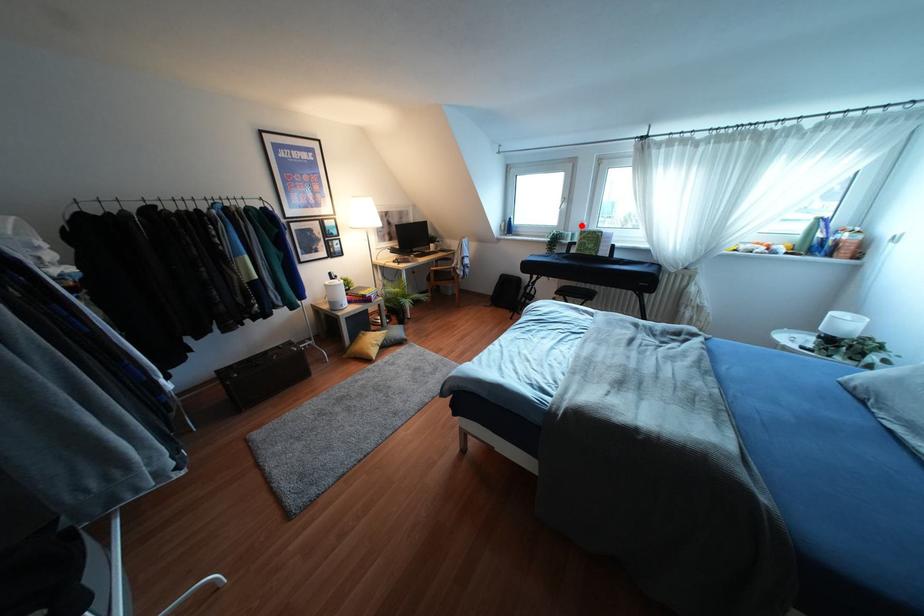
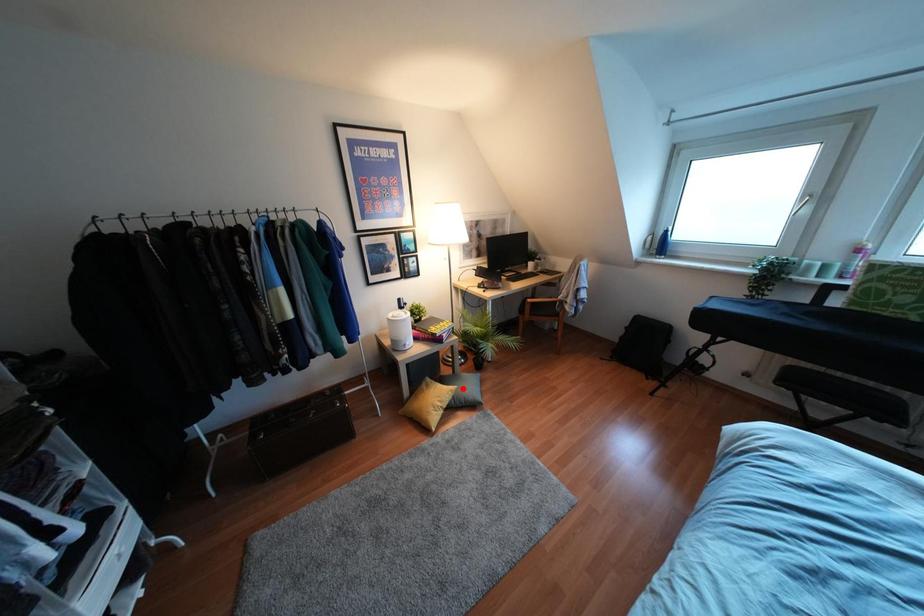
I am providing you with two images of the same scene from different viewpoints. A red point is marked on the first image and another point is marked on the second image. Is the marked point in image1 the same physical position as the marked point in image2?

No